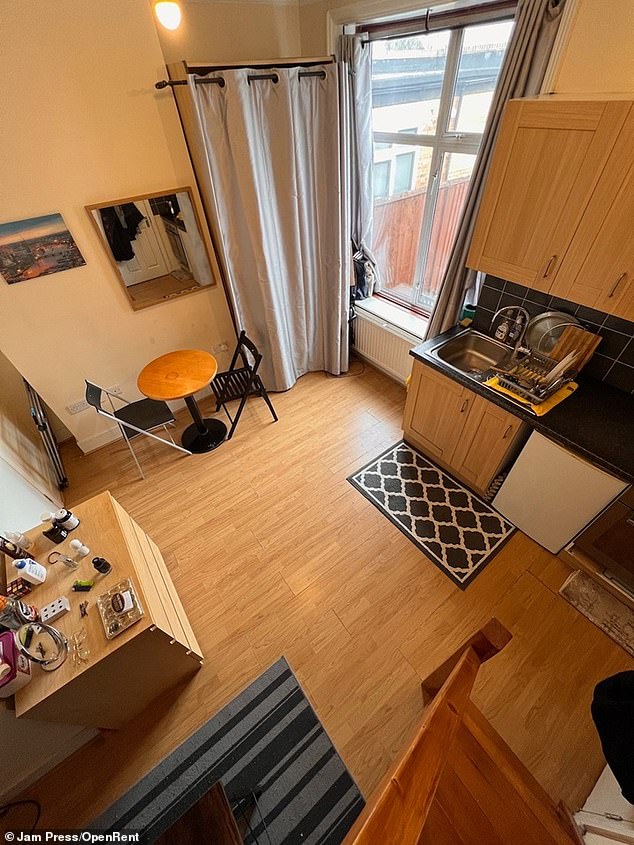
Find the location of a particular element. The image size is (634, 845). mat is located at coordinates (243, 766), (470, 510).